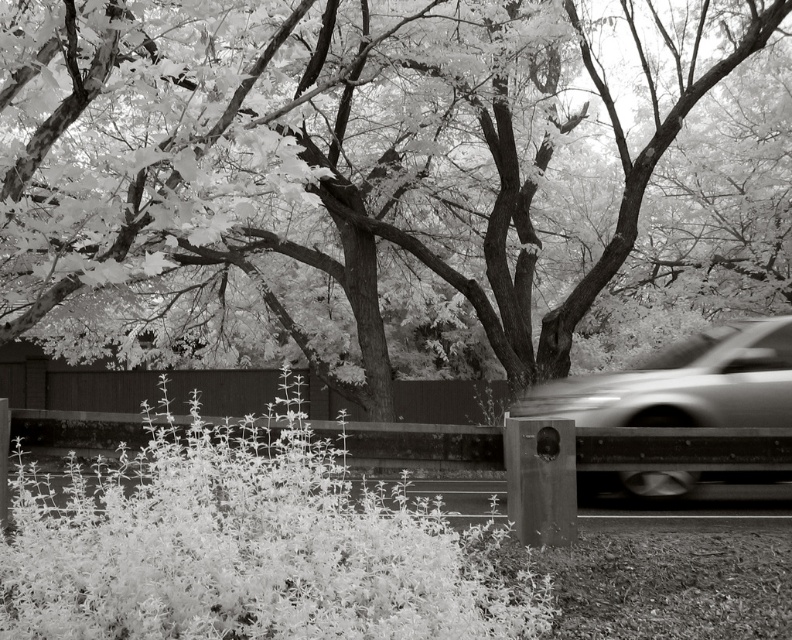
Is point (356, 6) closer to viewer compared to point (684, 385)?

No, it is not.

Measure the distance from smooth bark tree at center to metallic silver car at right.

smooth bark tree at center and metallic silver car at right are 6.36 meters apart from each other.

Measure the distance between smooth bark tree at center and camera.

smooth bark tree at center and camera are 14.53 feet apart from each other.

This screenshot has height=640, width=792. Identify the location of smooth bark tree at center. (309, 150).